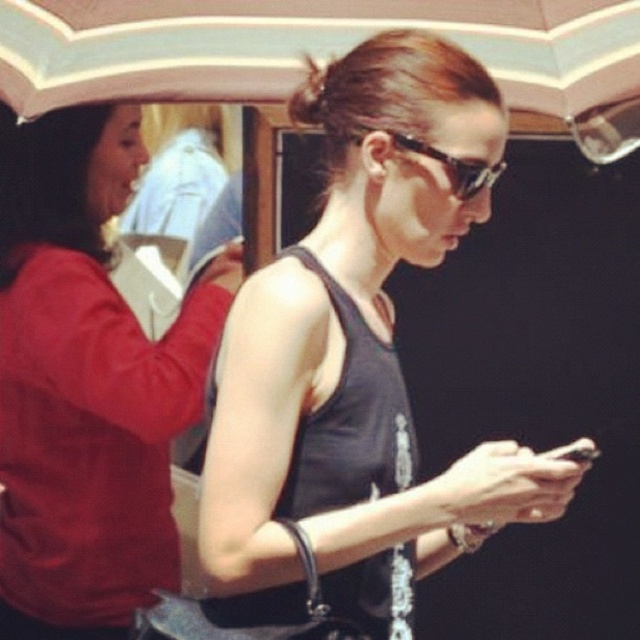
Question: Does matte black tank top at center have a smaller size compared to black plastic sunglasses at center?

Choices:
 (A) no
 (B) yes

Answer: (A)

Question: Based on their relative distances, which object is farther from the matte red sweater at left?

Choices:
 (A) black plastic sunglasses at center
 (B) white striped fabric umbrella at upper center
 (C) matte black tank top at center

Answer: (A)

Question: Can you confirm if matte red sweater at left is positioned above white striped fabric umbrella at upper center?

Choices:
 (A) no
 (B) yes

Answer: (A)

Question: Which point is closer to the camera?

Choices:
 (A) white striped fabric umbrella at upper center
 (B) matte black tank top at center
 (C) black plastic sunglasses at center

Answer: (B)

Question: Which object is positioned farthest from the black plastic sunglasses at center?

Choices:
 (A) matte red sweater at left
 (B) matte black tank top at center
 (C) white striped fabric umbrella at upper center

Answer: (A)

Question: Can you confirm if white striped fabric umbrella at upper center is thinner than black plastic sunglasses at center?

Choices:
 (A) no
 (B) yes

Answer: (A)